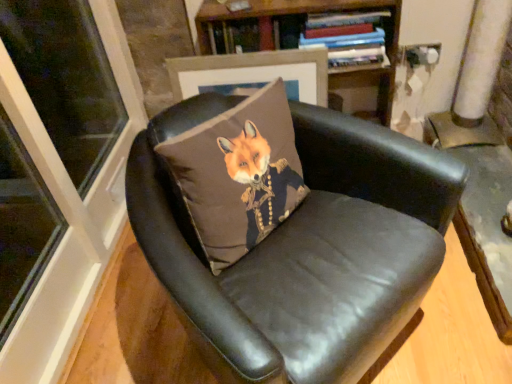
Question: Is brown fabric fox at center oriented away from wooden bookshelf at upper center?

Choices:
 (A) yes
 (B) no

Answer: (B)

Question: Does brown fabric fox at center come behind wooden bookshelf at upper center?

Choices:
 (A) no
 (B) yes

Answer: (A)

Question: Is brown fabric fox at center shorter than wooden bookshelf at upper center?

Choices:
 (A) no
 (B) yes

Answer: (B)

Question: From the image's perspective, would you say brown fabric fox at center is positioned over wooden bookshelf at upper center?

Choices:
 (A) no
 (B) yes

Answer: (A)

Question: Could you tell me if brown fabric fox at center is turned towards wooden bookshelf at upper center?

Choices:
 (A) no
 (B) yes

Answer: (A)

Question: Considering the positions of point (248, 64) and point (189, 163), is point (248, 64) closer or farther from the camera than point (189, 163)?

Choices:
 (A) closer
 (B) farther

Answer: (B)

Question: Is matte brown picture frame at upper center wider or thinner than brown fabric fox at center?

Choices:
 (A) thin
 (B) wide

Answer: (A)

Question: From a real-world perspective, is matte brown picture frame at upper center physically located above or below brown fabric fox at center?

Choices:
 (A) above
 (B) below

Answer: (B)

Question: Choose the correct answer: Is matte brown picture frame at upper center inside brown fabric fox at center or outside it?

Choices:
 (A) inside
 (B) outside

Answer: (B)

Question: Looking at the image, does brown fabric fox at center seem bigger or smaller compared to hardcover book at upper center?

Choices:
 (A) small
 (B) big

Answer: (B)

Question: From a real-world perspective, relative to hardcover book at upper center, is brown fabric fox at center vertically above or below?

Choices:
 (A) below
 (B) above

Answer: (A)

Question: Does point (234, 256) appear closer or farther from the camera than point (379, 31)?

Choices:
 (A) farther
 (B) closer

Answer: (B)

Question: Is brown fabric fox at center to the left or to the right of hardcover book at upper center in the image?

Choices:
 (A) right
 (B) left

Answer: (B)

Question: From a real-world perspective, is brown fabric fox at center physically located above or below black leather chair at center?

Choices:
 (A) below
 (B) above

Answer: (B)

Question: Based on their positions, is brown fabric fox at center located to the left or right of black leather chair at center?

Choices:
 (A) right
 (B) left

Answer: (B)